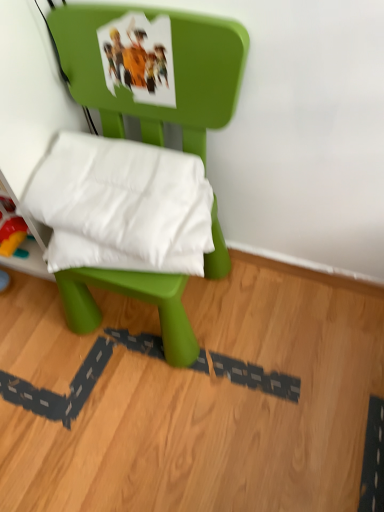
Locate an element on the screen. This screenshot has width=384, height=512. vacant space in front of green plastic chair at center is located at coordinates (159, 420).